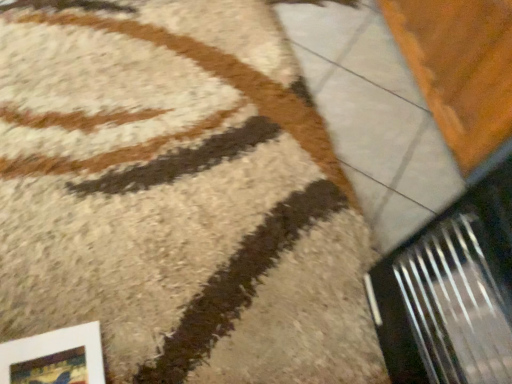
What do you see at coordinates (55, 357) in the screenshot? I see `white matte picture frame at lower left` at bounding box center [55, 357].

Consider the image. Measure the distance between point (70, 343) and camera.

They are 87.40 centimeters apart.

I want to click on white matte picture frame at lower left, so click(x=55, y=357).

Where is `white matte picture frame at lower left`? This screenshot has height=384, width=512. white matte picture frame at lower left is located at coordinates (55, 357).